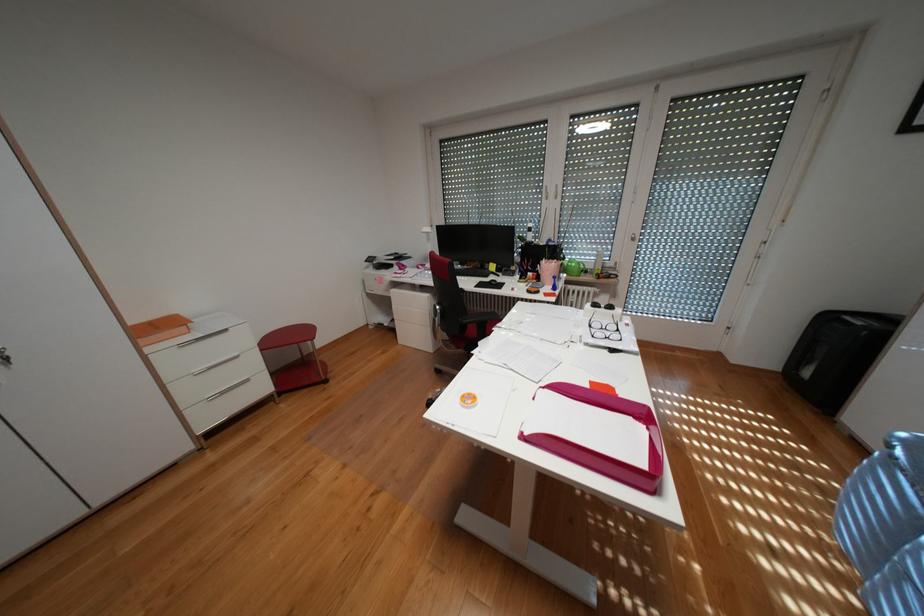
This screenshot has height=616, width=924. Describe the element at coordinates (5, 359) in the screenshot. I see `the metal door handle` at that location.